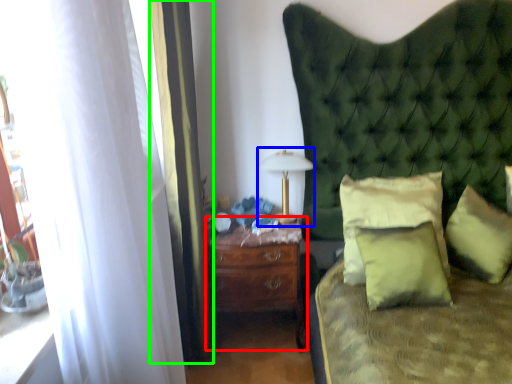
Question: Estimate the real-world distances between objects in this image. Which object is closer to nightstand (highlighted by a red box), bedside lamp (highlighted by a blue box) or curtain (highlighted by a green box)?

Choices:
 (A) bedside lamp
 (B) curtain

Answer: (B)